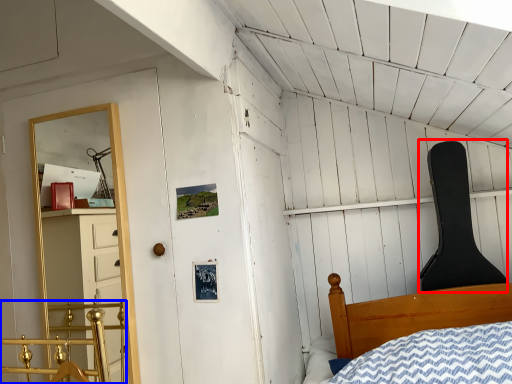
Question: Which object appears closest to the camera in this image, chair (highlighted by a red box) or rail (highlighted by a blue box)?

Choices:
 (A) chair
 (B) rail

Answer: (B)